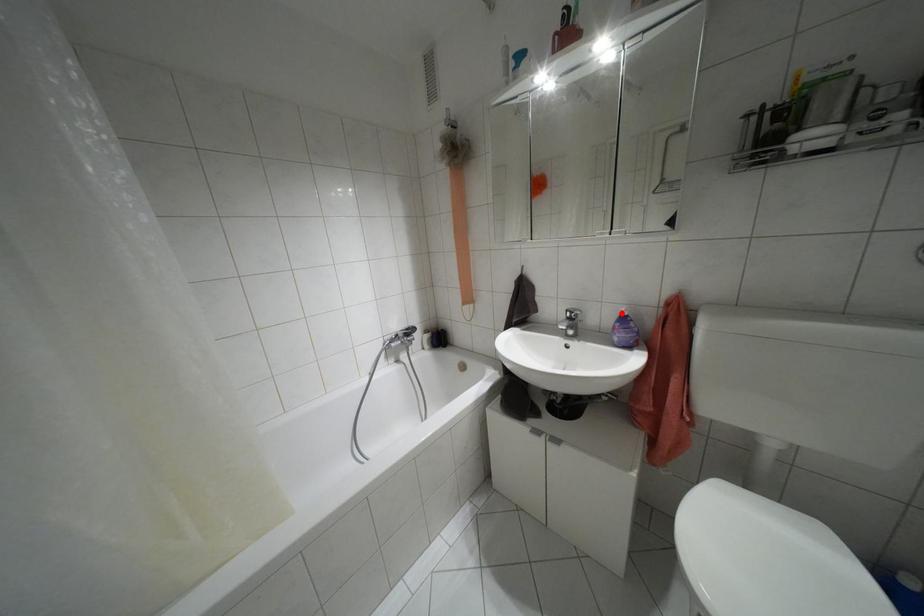
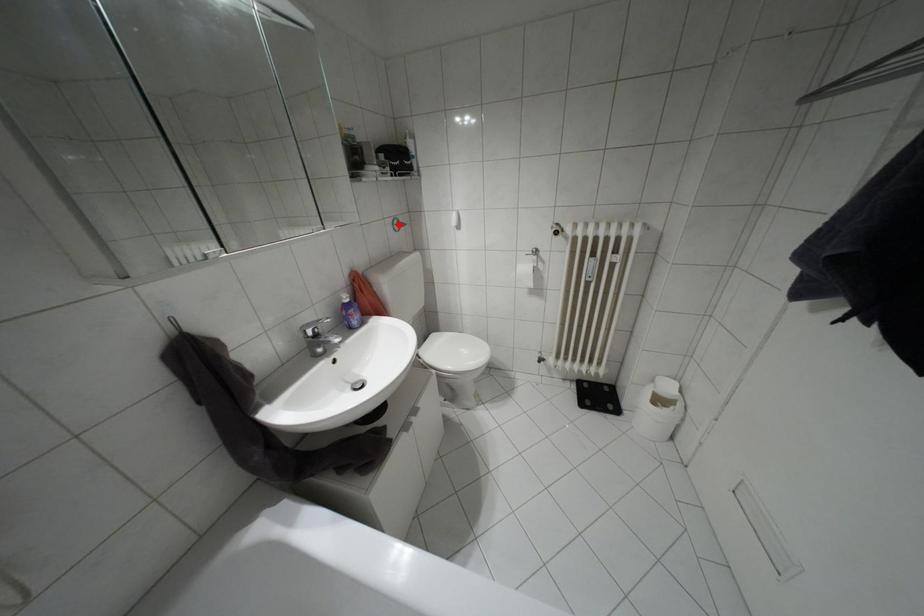
I am providing you with two images of the same scene from different viewpoints. A red point is marked on the first image and another point is marked on the second image. Are the points marked in image1 and image2 representing the same 3D position?

No